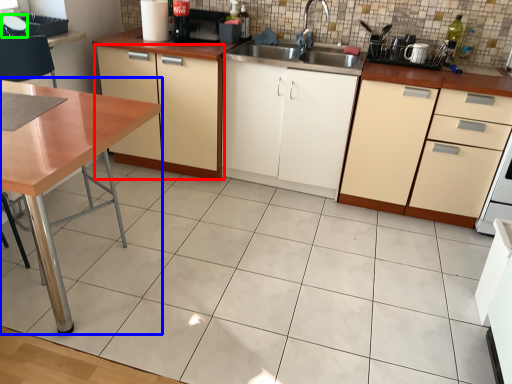
Question: Based on their relative distances, which object is nearer to cabinetry (highlighted by a red box)? Choose from table (highlighted by a blue box) and appliance (highlighted by a green box).

Choices:
 (A) table
 (B) appliance

Answer: (B)